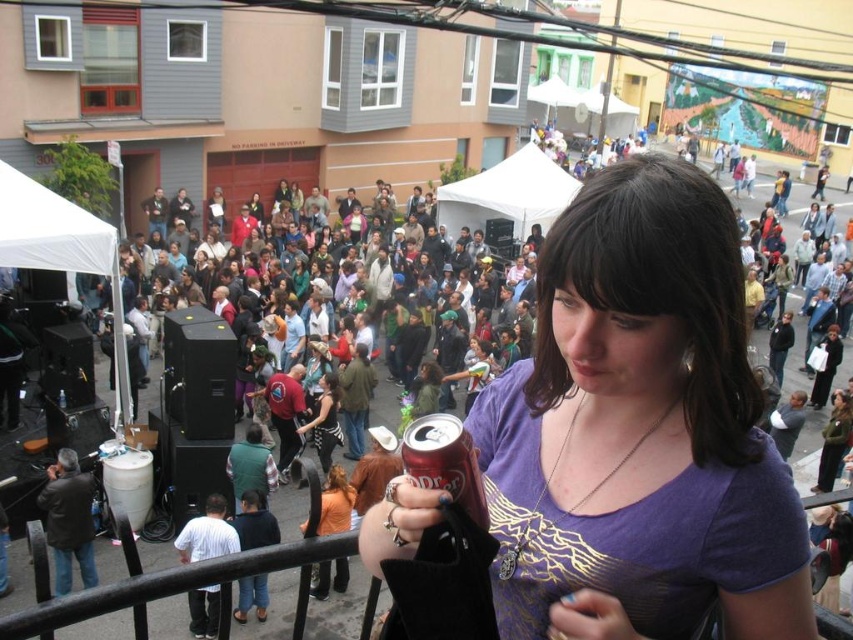
You are at the event and want to locate the person wearing the purple matte shirt at center. Which direction should you look relative to the person wearing the matte black jacket at center?

The purple matte shirt at center is to the right of the matte black jacket at center, so you should look to the right of the person wearing the matte black jacket at center to find the purple matte shirt at center.

You are a photographer at the event and want to capture a photo of both the purple matte shirt at center and the metallic red can at center. Which object should you focus on first to ensure it appears larger in the photo?

The purple matte shirt at center is taller than the metallic red can at center, so focusing on the purple matte shirt at center first will ensure it appears larger in the photo.